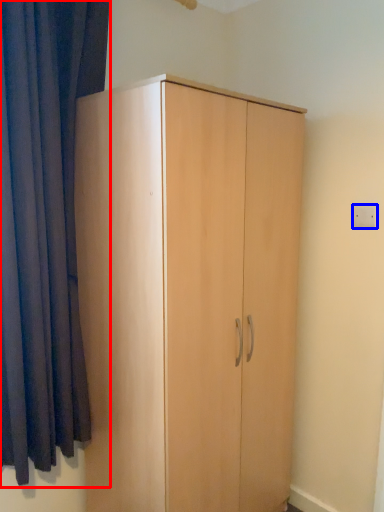
Question: Among these objects, which one is farthest to the camera, curtain (highlighted by a red box) or electric outlet (highlighted by a blue box)?

Choices:
 (A) curtain
 (B) electric outlet

Answer: (B)